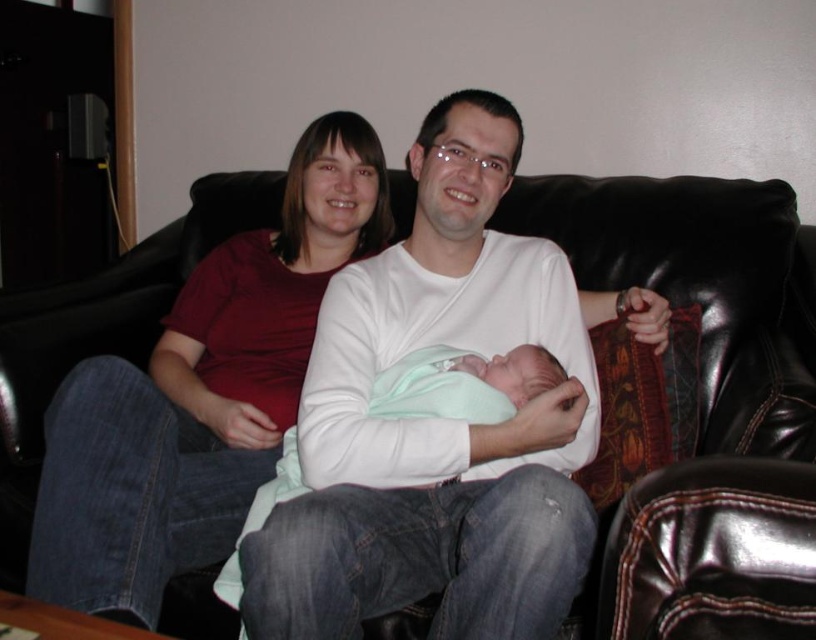
You are a delivery person trying to bring a large package into a living room. The package is 1.2 meters wide. You see the black leather couch at center and the matte red shirt at upper left. Can the package fit through the space between the couch and the wall?

The black leather couch at center might be wider than matte red shirt at upper left, but without specific width measurements, it is uncertain if the package can fit through the space between the couch and the wall.